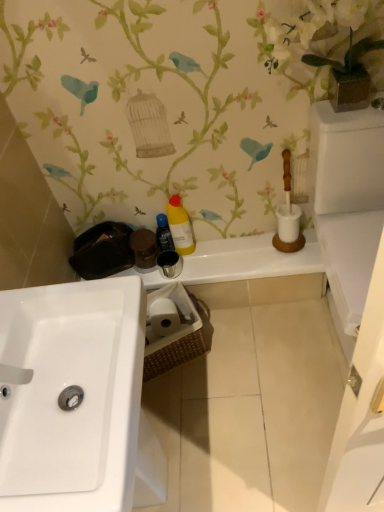
The width and height of the screenshot is (384, 512). Identify the location of free space to the right of yellow matte bottle at center, which is the 2th cleaning product in left-to-right order. (230, 248).